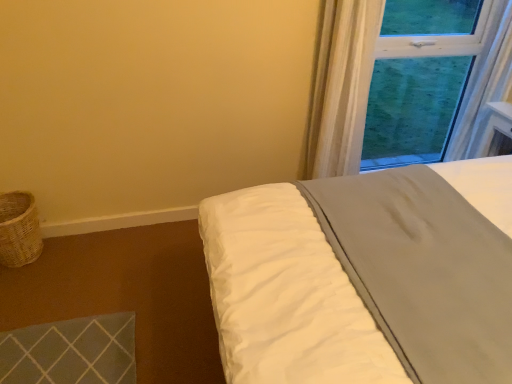
Question: Can you confirm if woven wicker basket at lower left is taller than white sheer curtain at upper right?

Choices:
 (A) yes
 (B) no

Answer: (B)

Question: Is the depth of woven wicker basket at lower left greater than that of white sheer curtain at upper right?

Choices:
 (A) no
 (B) yes

Answer: (B)

Question: Could you tell me if woven wicker basket at lower left is turned towards white sheer curtain at upper right?

Choices:
 (A) no
 (B) yes

Answer: (B)

Question: Is white sheer curtain at upper right a part of woven wicker basket at lower left?

Choices:
 (A) no
 (B) yes

Answer: (A)

Question: From a real-world perspective, is woven wicker basket at lower left physically above white sheer curtain at upper right?

Choices:
 (A) yes
 (B) no

Answer: (B)

Question: Based on their sizes in the image, would you say woven wicker basket at lower left is bigger or smaller than white sheer curtain at upper right?

Choices:
 (A) big
 (B) small

Answer: (B)

Question: From the image's perspective, is woven wicker basket at lower left above or below white sheer curtain at upper right?

Choices:
 (A) below
 (B) above

Answer: (A)

Question: Considering their positions, is woven wicker basket at lower left located in front of or behind white sheer curtain at upper right?

Choices:
 (A) front
 (B) behind

Answer: (B)

Question: Is point (28, 208) closer or farther from the camera than point (373, 23)?

Choices:
 (A) farther
 (B) closer

Answer: (A)

Question: From a real-world perspective, is woven wicker basket at lower left positioned above or below white soft bed at upper right?

Choices:
 (A) below
 (B) above

Answer: (A)

Question: Which is correct: woven wicker basket at lower left is inside white soft bed at upper right, or outside of it?

Choices:
 (A) outside
 (B) inside

Answer: (A)

Question: Relative to white soft bed at upper right, is woven wicker basket at lower left in front or behind?

Choices:
 (A) behind
 (B) front

Answer: (A)

Question: Looking at the image, does woven wicker basket at lower left seem bigger or smaller compared to white soft bed at upper right?

Choices:
 (A) big
 (B) small

Answer: (B)

Question: From a real-world perspective, is white sheer curtain at upper right above or below white soft bed at upper right?

Choices:
 (A) above
 (B) below

Answer: (A)

Question: From the image's perspective, is white sheer curtain at upper right positioned above or below white soft bed at upper right?

Choices:
 (A) below
 (B) above

Answer: (B)